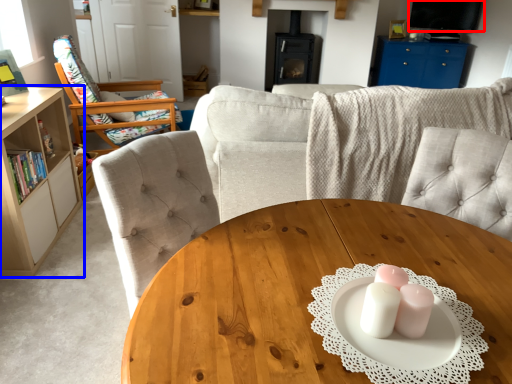
Question: Among these objects, which one is farthest to the camera, television (highlighted by a red box) or cabinetry (highlighted by a blue box)?

Choices:
 (A) television
 (B) cabinetry

Answer: (A)